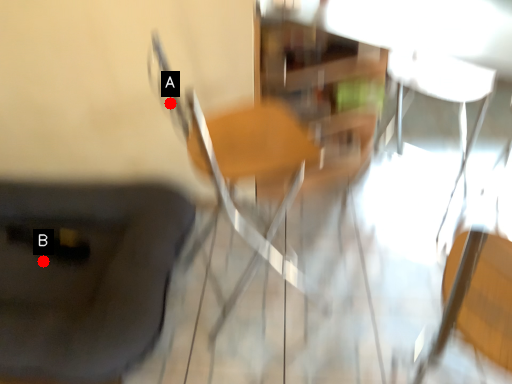
Question: Two points are circled on the image, labeled by A and B beside each circle. Which point appears farthest from the camera in this image?

Choices:
 (A) A is further
 (B) B is further

Answer: (B)